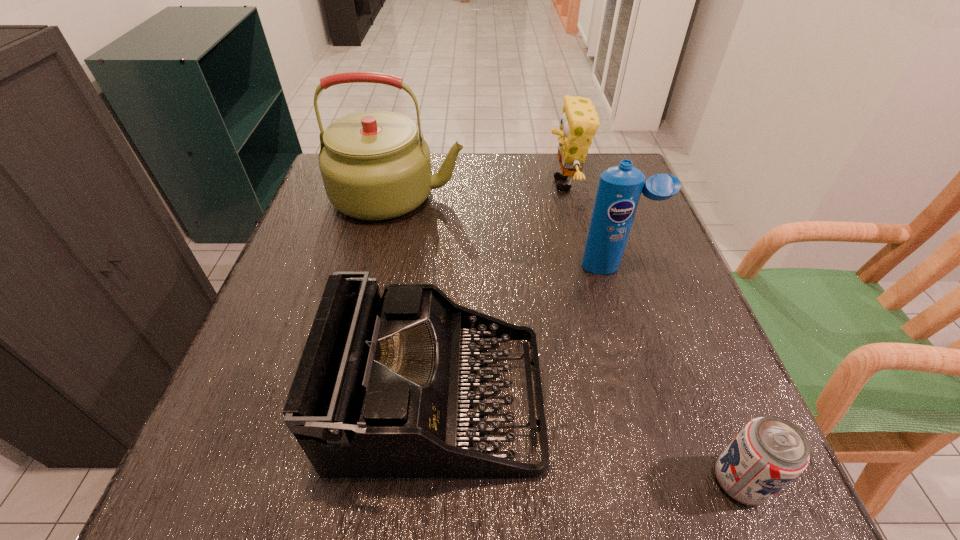
In the image, there is a desktop. Where is `free region at the near right corner`? free region at the near right corner is located at coordinates (704, 463).

Locate an element on the screen. The height and width of the screenshot is (540, 960). vacant space that's between the kettle and the sponge is located at coordinates (481, 190).

Locate an element on the screen. This screenshot has height=540, width=960. free space that is in between the typewriter and the sponge is located at coordinates (501, 292).

Identify the location of free space between the sponge and the kettle. (481, 190).

This screenshot has height=540, width=960. I want to click on free area in between the second shortest object and the sponge, so click(501, 292).

Where is `vacant area that lies between the beer can and the fourth shortest object`? The height and width of the screenshot is (540, 960). vacant area that lies between the beer can and the fourth shortest object is located at coordinates (677, 374).

Find the location of a particular element. The height and width of the screenshot is (540, 960). free space between the beer can and the kettle is located at coordinates (568, 338).

Identify the location of vacant region between the sponge and the typewriter. (501, 292).

This screenshot has height=540, width=960. Identify the location of free space between the shortest object and the kettle. (568, 338).

Locate which object is the closest to the kettle. Please provide its 2D coordinates. Your answer should be formatted as a tuple, i.e. [(x, y)], where the tuple contains the x and y coordinates of a point satisfying the conditions above.

[(579, 122)]